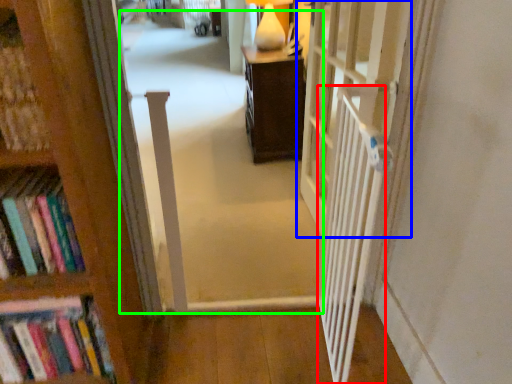
Question: Considering the real-world distances, which object is closest to balustrade (highlighted by a red box)? door (highlighted by a blue box) or corridor (highlighted by a green box).

Choices:
 (A) door
 (B) corridor

Answer: (A)